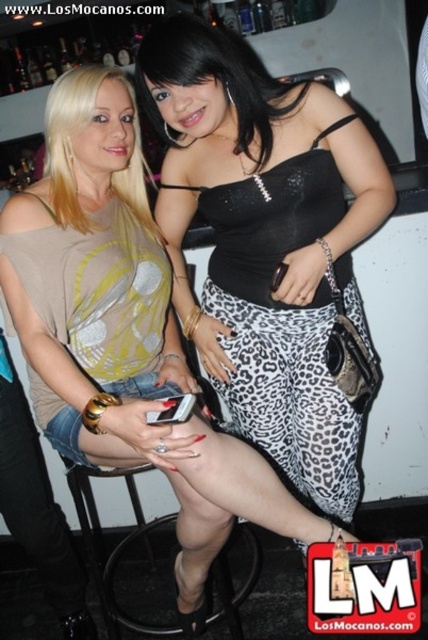
Question: Which of the following is the farthest from the observer?

Choices:
 (A) (249, 268)
 (B) (130, 538)

Answer: (B)

Question: Can you confirm if black leopard print pants at center is bigger than black plastic bar stool at lower center?

Choices:
 (A) yes
 (B) no

Answer: (B)

Question: Is black leopard print pants at center in front of black plastic bar stool at lower center?

Choices:
 (A) yes
 (B) no

Answer: (A)

Question: Which object is closer to the camera taking this photo?

Choices:
 (A) black plastic bar stool at lower center
 (B) black leopard print pants at center

Answer: (B)

Question: Is black leopard print pants at center further to the viewer compared to black plastic bar stool at lower center?

Choices:
 (A) no
 (B) yes

Answer: (A)